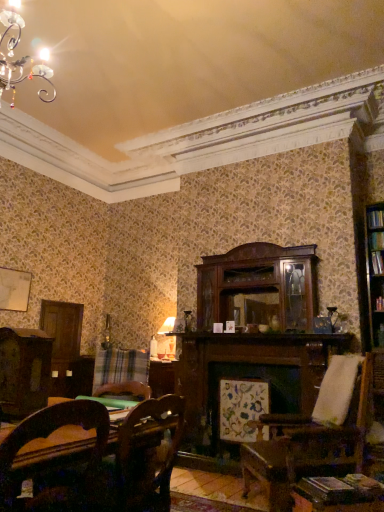
What do you see at coordinates (47, 436) in the screenshot?
I see `wooden chair at lower left` at bounding box center [47, 436].

Measure the distance between plaid fabric at lower left and camera.

plaid fabric at lower left is 3.65 meters away from camera.

At what (x,y) coordinates should I click in order to perform the action: click on wooden table at lower right. Please return your answer as a coordinate pair (x, y). The width and height of the screenshot is (384, 512). Looking at the image, I should click on (338, 494).

Would you say hardcover book at right is to the left or to the right of wooden chair at lower left in the picture?

hardcover book at right is to the right of wooden chair at lower left.

You are a GUI agent. You are given a task and a screenshot of the screen. Output one action in this format:
    pyautogui.click(x=<x>, y=<y>)
    Task: Click on the chair below the hardcover book at right (from the image's perspective)
    The height and width of the screenshot is (512, 384).
    Given the screenshot: What is the action you would take?
    pyautogui.click(x=47, y=436)

Considering the sizes of objects hardcover book at right and wooden chair at lower left in the image provided, who is bigger, hardcover book at right or wooden chair at lower left?

wooden chair at lower left is bigger.

From the image's perspective, is hardcover book at right located above or below wooden chair at lower left?

From the image's perspective, hardcover book at right appears above wooden chair at lower left.

From a real-world perspective, is wooden chair at lower left on wooden table at lower right?

Yes, from a real-world perspective, wooden chair at lower left is on top of wooden table at lower right.

Based on the photo, is wooden chair at lower left looking in the opposite direction of wooden table at lower right?

No.

Can you tell me how much wooden chair at lower left and wooden table at lower right differ in facing direction?

46.4 degrees.

Does wooden chair at lower left appear on the left side of wooden table at lower right?

Correct, you'll find wooden chair at lower left to the left of wooden table at lower right.

Measure the distance between hardcover book at right and plaid fabric at lower left.

The distance of hardcover book at right from plaid fabric at lower left is 2.45 meters.

Considering the positions of objects hardcover book at right and plaid fabric at lower left in the image provided, who is more to the right, hardcover book at right or plaid fabric at lower left?

hardcover book at right.

From the image's perspective, is hardcover book at right positioned above or below plaid fabric at lower left?

hardcover book at right is above plaid fabric at lower left.

Who is smaller, hardcover book at right or plaid fabric at lower left?

hardcover book at right is smaller.

Is hardcover book at right completely or partially outside of wooden table at lower right?

That's correct, hardcover book at right is outside of wooden table at lower right.

From the image's perspective, is hardcover book at right located beneath wooden table at lower right?

Actually, hardcover book at right appears above wooden table at lower right in the image.

Locate an element on the screen. The height and width of the screenshot is (512, 384). table on the left of hardcover book at right is located at coordinates (338, 494).

Is hardcover book at right oriented towards wooden table at lower right?

No, hardcover book at right is not turned towards wooden table at lower right.

Is wooden table at lower right facing away from plaid fabric at lower left?

That's not correct — wooden table at lower right is not looking away from plaid fabric at lower left.

Does wooden table at lower right come in front of plaid fabric at lower left?

Yes, wooden table at lower right is closer to the viewer.

What's the angular difference between wooden table at lower right and plaid fabric at lower left's facing directions?

83.9 degrees.

From the image's perspective, is wooden table at lower right positioned above or below plaid fabric at lower left?

Clearly, from the image's perspective, wooden table at lower right is below plaid fabric at lower left.

How different are the orientations of plaid fabric at lower left and wooden chair at lower left in degrees?

The angular difference between plaid fabric at lower left and wooden chair at lower left is 130 degrees.

Is plaid fabric at lower left positioned with its back to wooden chair at lower left?

No, plaid fabric at lower left is not facing the opposite direction of wooden chair at lower left.

Does plaid fabric at lower left appear on the left side of wooden chair at lower left?

Indeed, plaid fabric at lower left is positioned on the left side of wooden chair at lower left.

Is plaid fabric at lower left taller than wooden table at lower right?

Yes, plaid fabric at lower left is taller than wooden table at lower right.

Considering the positions of point (112, 393) and point (318, 497), is point (112, 393) closer or farther from the camera than point (318, 497)?

Clearly, point (112, 393) is more distant from the camera than point (318, 497).

Where is `table located below the plaid fabric at lower left (from the image's perspective)`? table located below the plaid fabric at lower left (from the image's perspective) is located at coordinates (338, 494).

Between plaid fabric at lower left and wooden table at lower right, which one has larger size?

plaid fabric at lower left.

You are a GUI agent. You are given a task and a screenshot of the screen. Output one action in this format:
    pyautogui.click(x=<x>, y=<y>)
    Task: Click on the book that appears on the right of wooden chair at lower left
    
    Given the screenshot: What is the action you would take?
    pyautogui.click(x=377, y=262)

The image size is (384, 512). Find the location of `table located below the wooden chair at lower left (from the image's perspective)`. table located below the wooden chair at lower left (from the image's perspective) is located at coordinates (338, 494).

Which object lies nearer to the anchor point hardcover book at right, wooden table at lower right or plaid fabric at lower left?

wooden table at lower right.

Estimate the real-world distances between objects in this image. Which object is further from plaid fabric at lower left, hardcover book at right or wooden chair at lower left?

hardcover book at right is further to plaid fabric at lower left.

Considering their positions, is wooden table at lower right positioned further to hardcover book at right than wooden chair at lower left?

Among the two, wooden chair at lower left is located further to hardcover book at right.

When comparing their distances from hardcover book at right, does wooden chair at lower left or plaid fabric at lower left seem closer?

Among the two, plaid fabric at lower left is located nearer to hardcover book at right.

Which object lies nearer to the anchor point hardcover book at right, plaid fabric at lower left or wooden chair at lower left?

plaid fabric at lower left is positioned closer to the anchor hardcover book at right.

Based on the photo, which object lies further to the anchor point wooden chair at lower left, hardcover book at right or plaid fabric at lower left?

hardcover book at right lies further to wooden chair at lower left than the other object.

Based on their spatial positions, is hardcover book at right or wooden table at lower right further from plaid fabric at lower left?

Among the two, hardcover book at right is located further to plaid fabric at lower left.

Looking at the image, which one is located further to wooden table at lower right, plaid fabric at lower left or hardcover book at right?

plaid fabric at lower left is positioned further to the anchor wooden table at lower right.

I want to click on table between wooden chair at lower left and hardcover book at right from front to back, so click(x=338, y=494).

You are a GUI agent. You are given a task and a screenshot of the screen. Output one action in this format:
    pyautogui.click(x=<x>, y=<y>)
    Task: Click on the table positioned between wooden chair at lower left and plaid fabric at lower left from near to far
    
    Given the screenshot: What is the action you would take?
    pos(338,494)

Where is `plaid between wooden chair at lower left and hardcover book at right along the z-axis`? This screenshot has width=384, height=512. plaid between wooden chair at lower left and hardcover book at right along the z-axis is located at coordinates (120, 367).

At what (x,y) coordinates should I click in order to perform the action: click on table between plaid fabric at lower left and hardcover book at right in the horizontal direction. Please return your answer as a coordinate pair (x, y). Looking at the image, I should click on (338, 494).